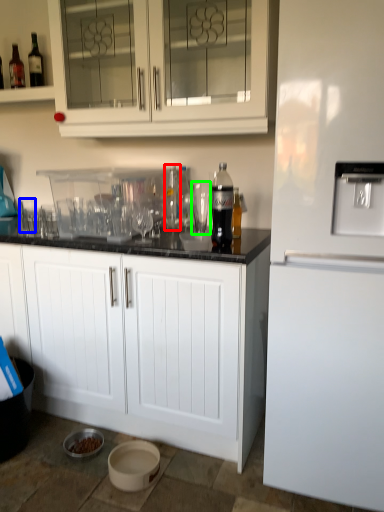
Question: Estimate the real-world distances between objects in this image. Which object is closer to bottle (highlighted by a red box), shot glass (highlighted by a blue box) or shot glass (highlighted by a green box)?

Choices:
 (A) shot glass
 (B) shot glass

Answer: (B)